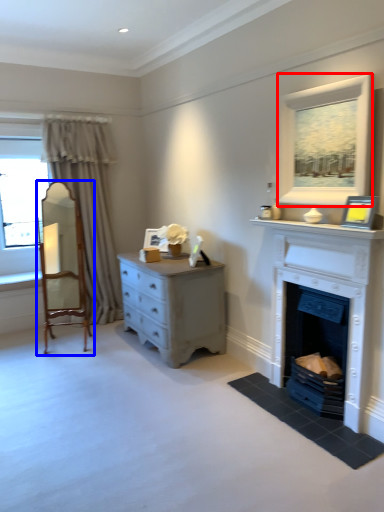
Question: Which of the following is the farthest to the observer, window (highlighted by a red box) or armchair (highlighted by a blue box)?

Choices:
 (A) window
 (B) armchair

Answer: (B)